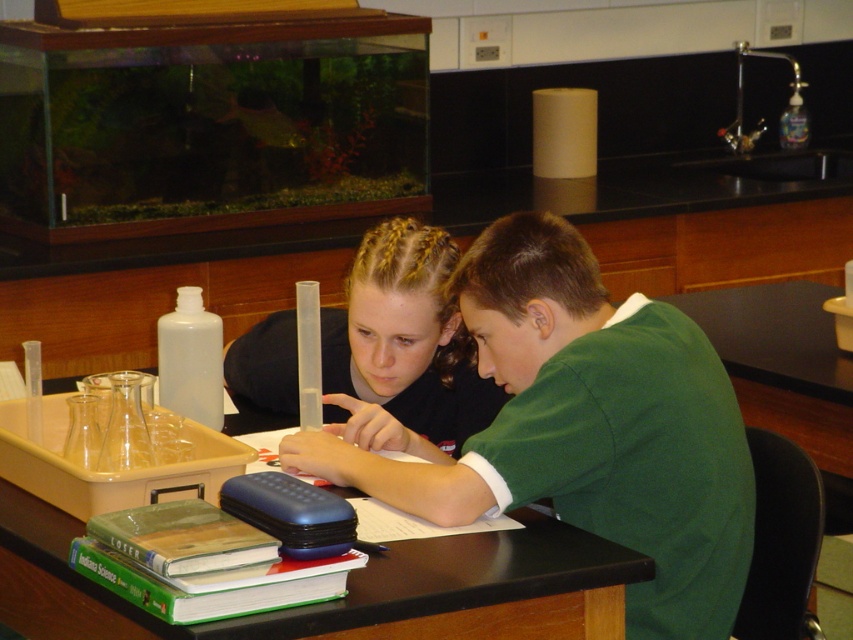
Question: Which point is farther to the camera?

Choices:
 (A) (457, 360)
 (B) (398, 566)

Answer: (A)

Question: Which point is farther to the camera?

Choices:
 (A) smooth black shirt at center
 (B) green matte shirt at center
 (C) black matte table at center

Answer: (A)

Question: Is green matte shirt at center smaller than smooth black shirt at center?

Choices:
 (A) yes
 (B) no

Answer: (B)

Question: Is black matte table at center positioned in front of smooth black shirt at center?

Choices:
 (A) no
 (B) yes

Answer: (B)

Question: Is green matte shirt at center wider than black matte table at center?

Choices:
 (A) no
 (B) yes

Answer: (A)

Question: Which point is farther to the camera?

Choices:
 (A) (529, 314)
 (B) (289, 387)
 (C) (363, 636)

Answer: (B)